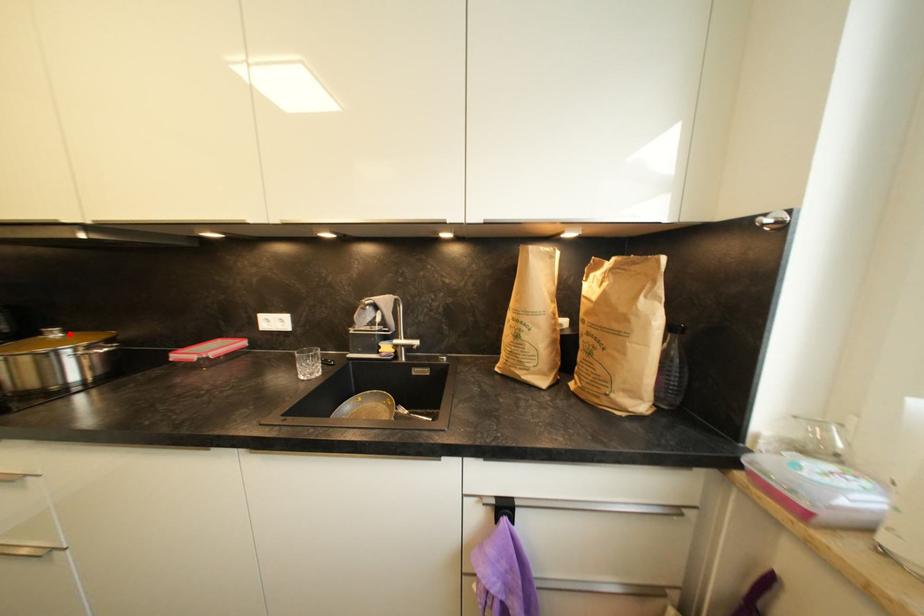
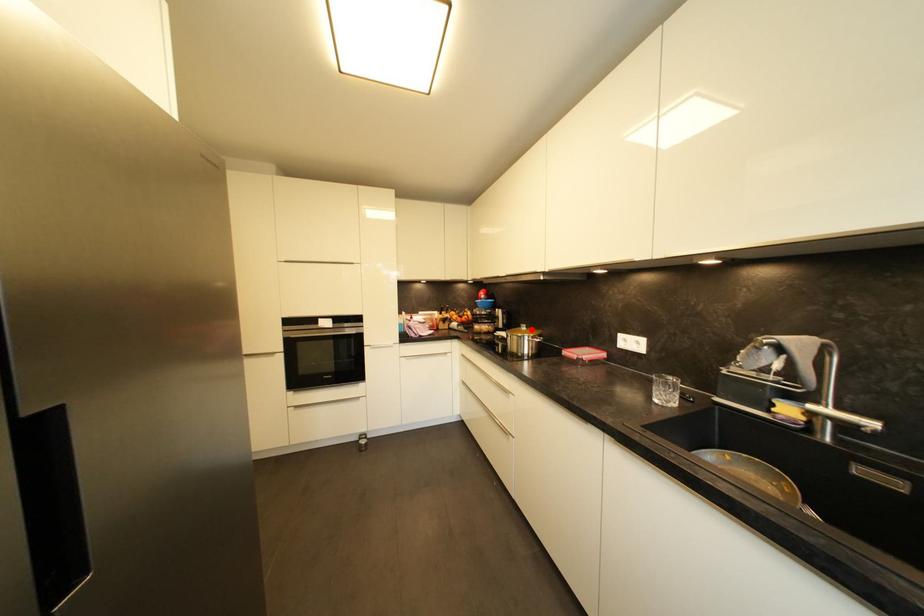
I am providing you with two images of the same scene from different viewpoints. A red point is marked on the first image and another point is marked on the second image. Are the points marked in image1 and image2 representing the same 3D position?

Yes